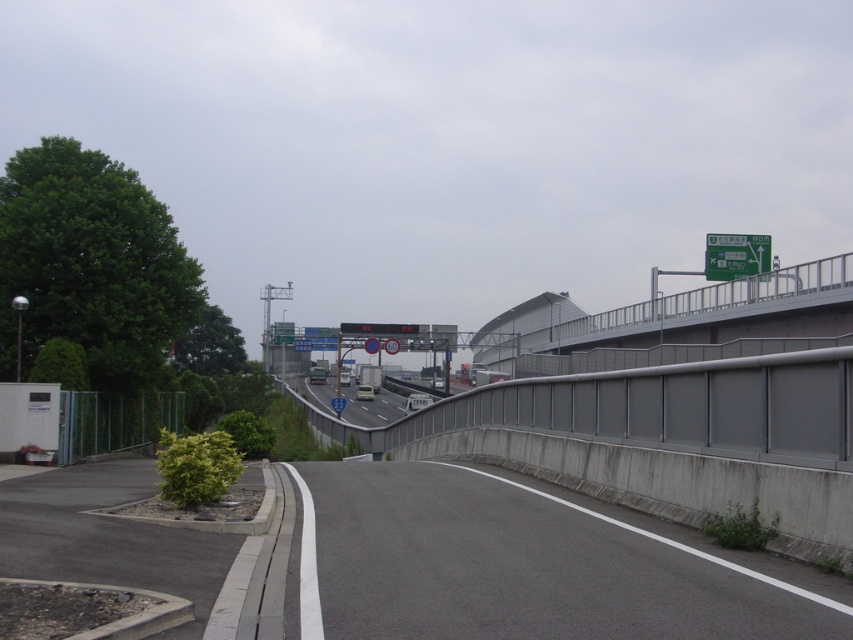
Does gray asphalt road at center appear on the right side of green plastic traffic sign at upper right?

Incorrect, gray asphalt road at center is not on the right side of green plastic traffic sign at upper right.

Looking at this image, does gray asphalt road at center lie behind green plastic traffic sign at upper right?

No, gray asphalt road at center is in front of green plastic traffic sign at upper right.

Is point (672, 536) positioned behind point (741, 256)?

No.

Locate an element on the screen. The width and height of the screenshot is (853, 640). gray asphalt road at center is located at coordinates (537, 564).